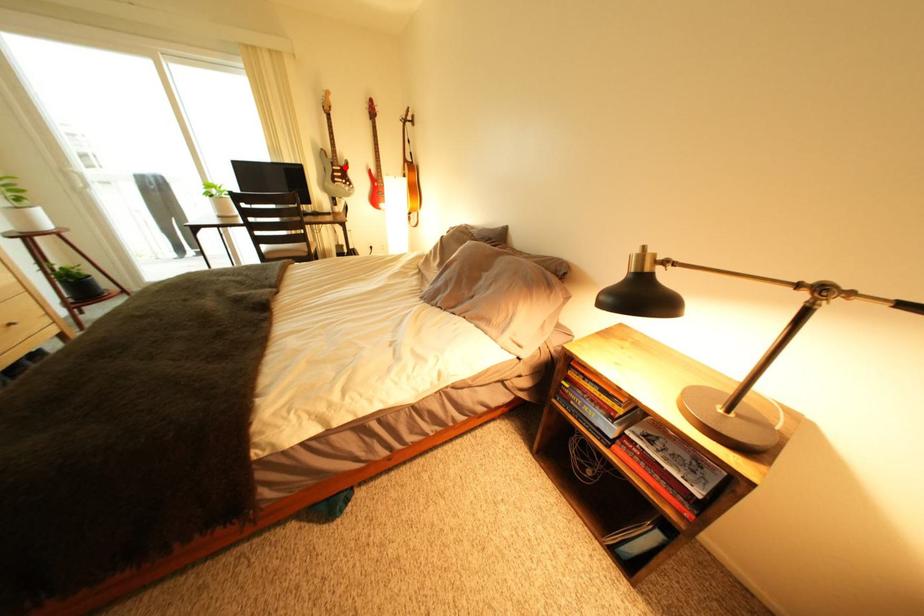
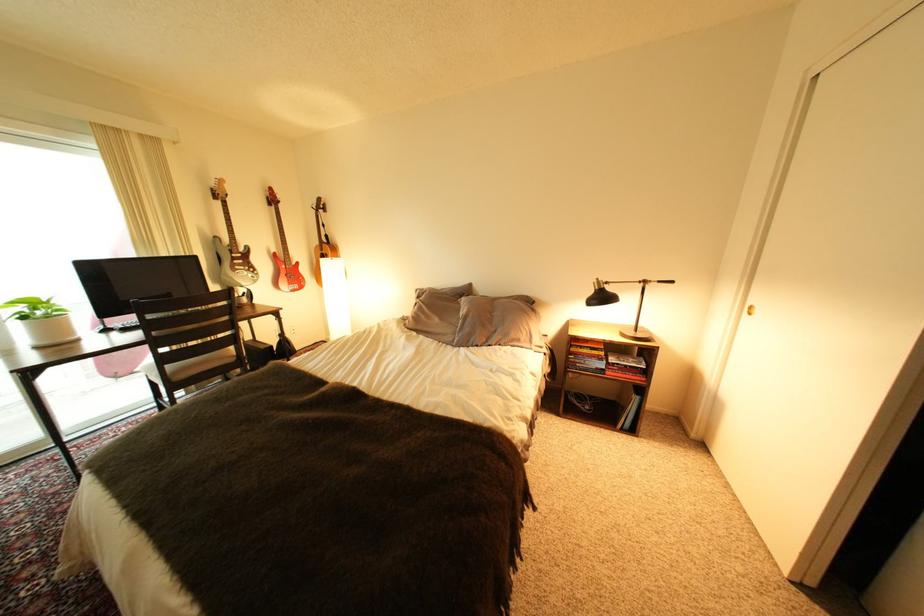
Question: I am providing you with two images of the same scene from different viewpoints. In image1, a red point is highlighted. Considering the same 3D point in image2, which of the following is correct?

Choices:
 (A) It is closer
 (B) It is farther

Answer: (B)